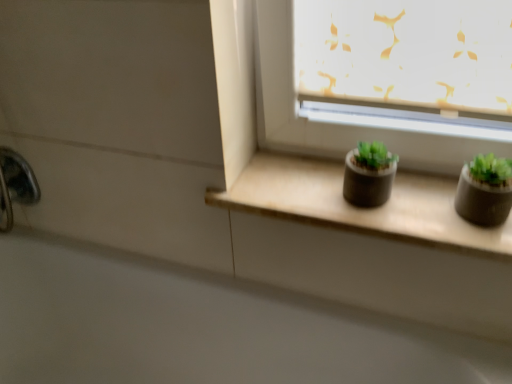
Find the location of a particular element. This screenshot has height=384, width=512. free spot above matte concrete window sill at center (from a real-world perspective) is located at coordinates (346, 187).